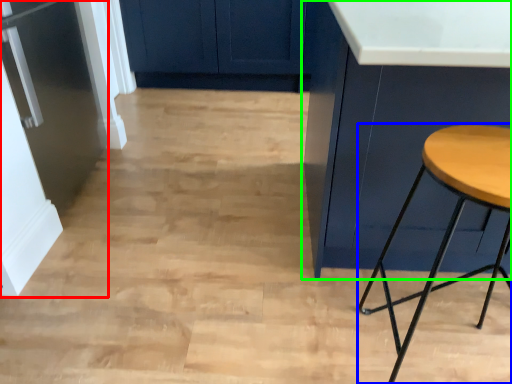
Question: Which is farther away from fridge (highlighted by a red box)? stool (highlighted by a blue box) or cabinetry (highlighted by a green box)?

Choices:
 (A) stool
 (B) cabinetry

Answer: (A)